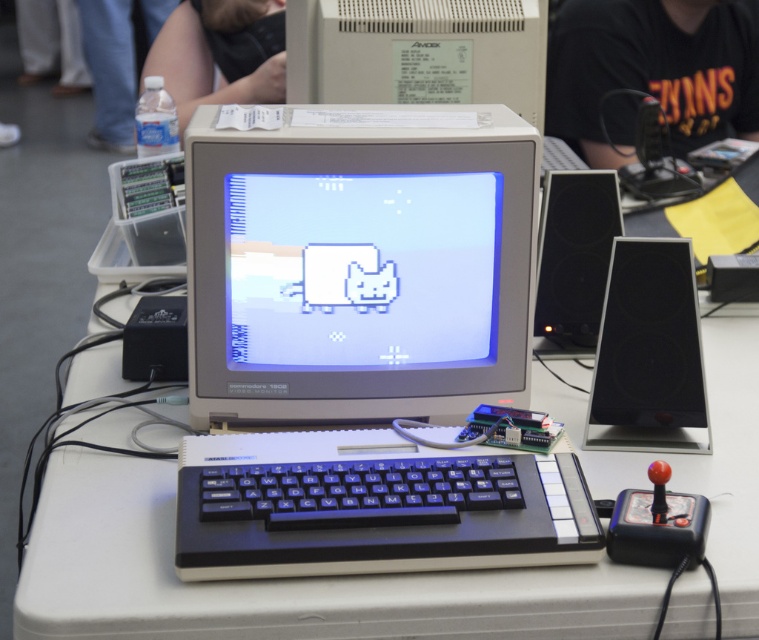
You are setting up a new gaming setup and want to place a matte gray monitor at center. According to the image, where should you place it?

The matte gray monitor at center should be placed at point (357, 262) as per the coordinates provided.

You are setting up a retro gaming station and need to place the matte gray monitor at center and the black plastic keyboard at center on a table. The monitor requires 10 inches of space in front of it for proper ventilation. Is there enough space between the two devices to meet this requirement?

The matte gray monitor at center and black plastic keyboard at center are 5.01 inches apart from each other. Since the monitor needs 10 inches of space, the current distance is insufficient. Move the keyboard further away to ensure proper ventilation.

Consider the image. You are setting up a new gaming station and need to place the matte gray monitor at center and the white plastic computer monitor at upper center. According to the image, which monitor should be placed higher up?

The white plastic computer monitor at upper center should be placed higher up because it is located above the matte gray monitor at center in the image.